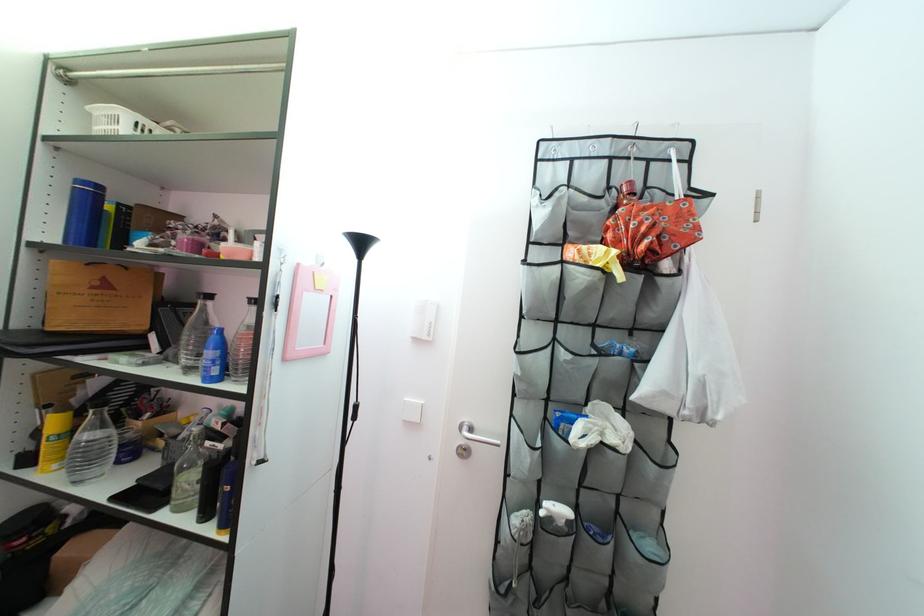
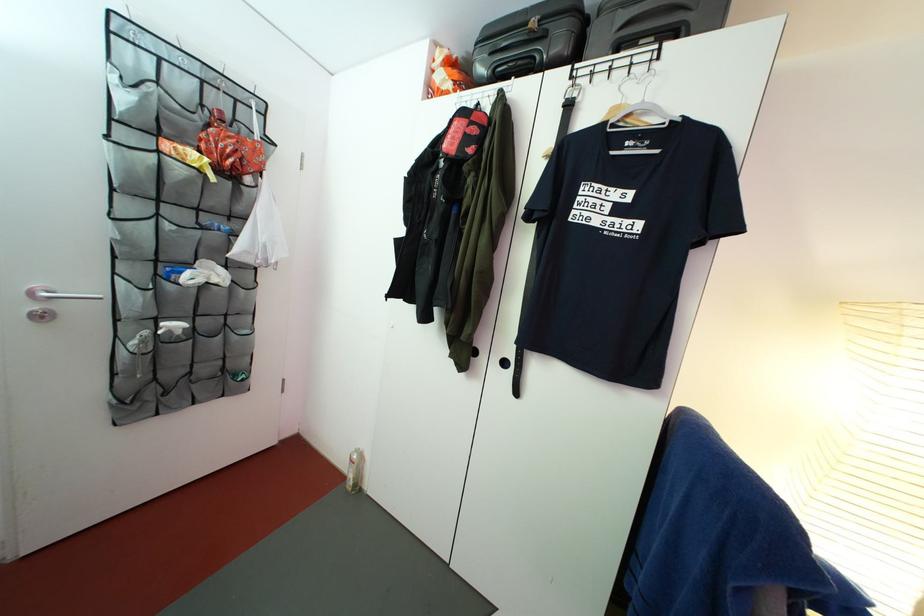
Question: Based on the continuous images, in which direction is the camera rotating? Reply with the corresponding letter.

Choices:
 (A) Left
 (B) Right
 (C) Up
 (D) Down

Answer: (B)